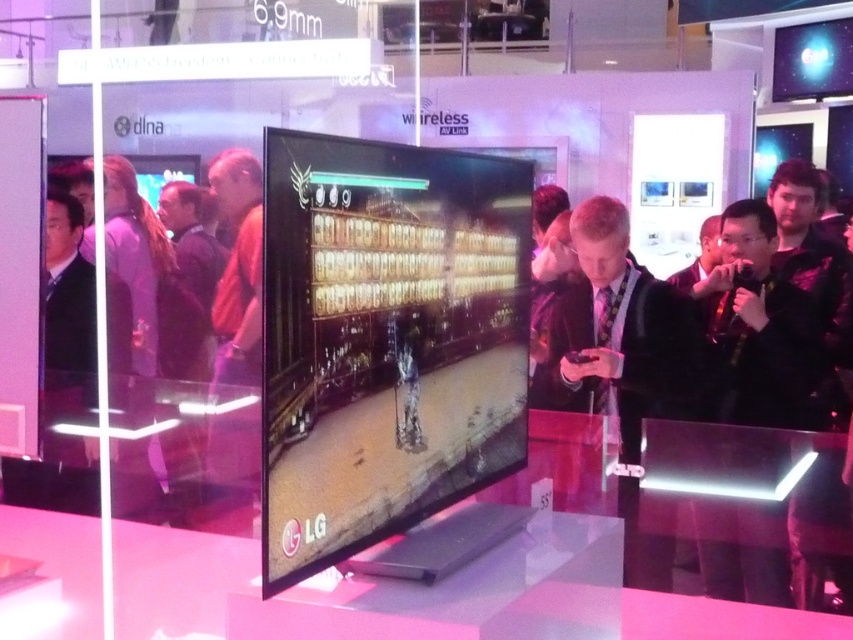
Question: Observing the image, what is the correct spatial positioning of black matte jacket at right in reference to black suit at center?

Choices:
 (A) above
 (B) below

Answer: (A)

Question: Does black matte jacket at right appear on the left side of black suit at center?

Choices:
 (A) no
 (B) yes

Answer: (A)

Question: Can you confirm if black matte jacket at right is thinner than black suit at center?

Choices:
 (A) yes
 (B) no

Answer: (A)